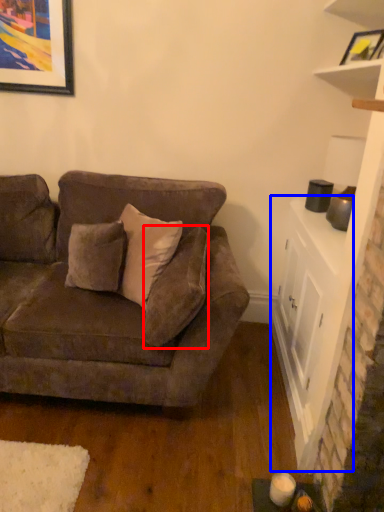
Question: Which point is further to the camera, pillow (highlighted by a red box) or table (highlighted by a blue box)?

Choices:
 (A) pillow
 (B) table

Answer: (B)